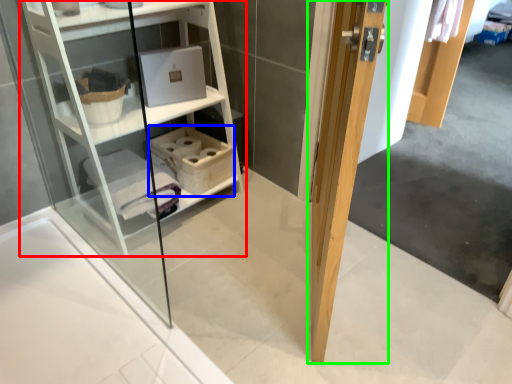
Question: Which object is positioned closest to shelf (highlighted by a red box)? Select from basket (highlighted by a blue box) and door (highlighted by a green box).

Choices:
 (A) basket
 (B) door

Answer: (A)